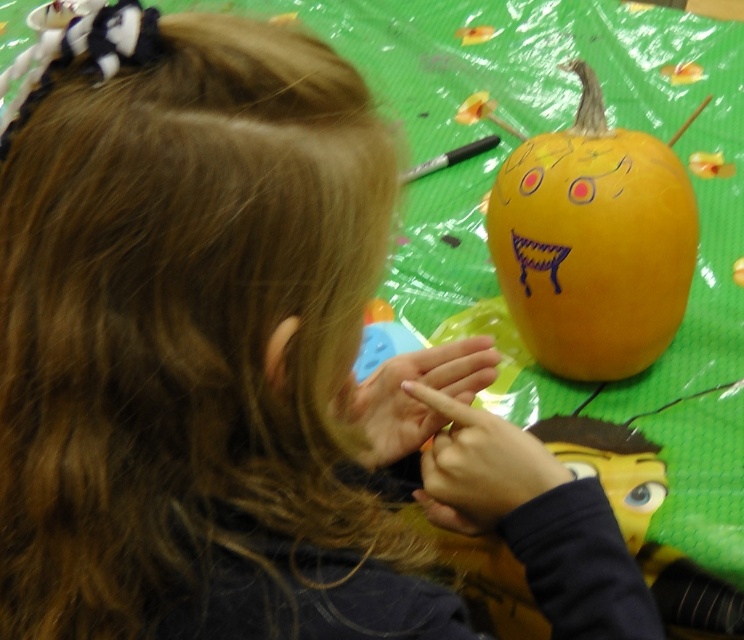
Which of these two, matte orange pumpkin at center or smooth yellow face at center, stands taller?

With more height is matte orange pumpkin at center.

Who is positioned more to the left, matte orange pumpkin at center or smooth yellow face at center?

smooth yellow face at center is more to the left.

Where is `matte orange pumpkin at center`? This screenshot has height=640, width=744. matte orange pumpkin at center is located at coordinates (593, 243).

At what (x,y) coordinates should I click in order to perform the action: click on matte orange pumpkin at center. Please return your answer as a coordinate pair (x, y). Looking at the image, I should click on (593, 243).